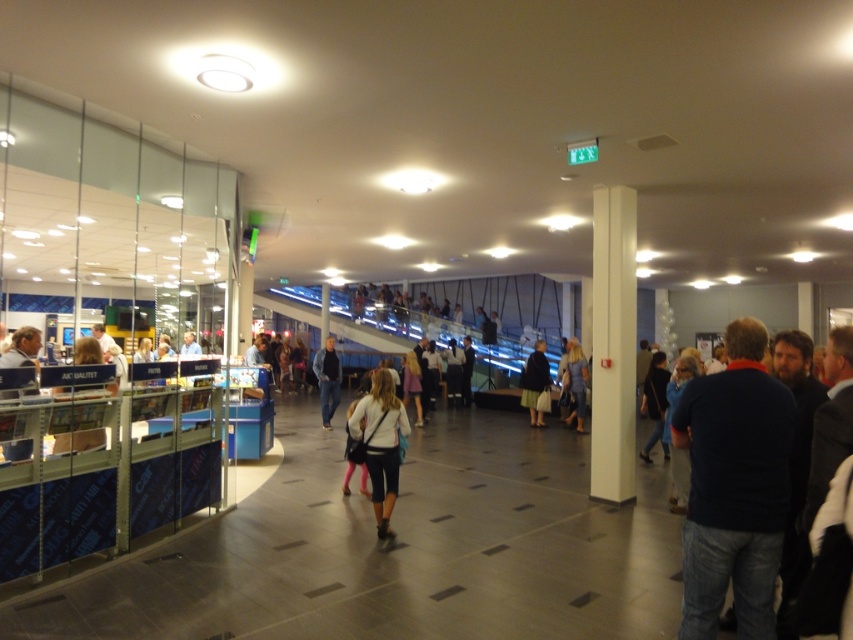
Is white matte shirt at center wider than light brown leather jacket at center?

Yes.

Between point (364, 458) and point (579, 358), which one is positioned behind?

The point (579, 358) is behind.

Is point (389, 448) farther from camera compared to point (570, 380)?

No, (389, 448) is in front of (570, 380).

Locate an element on the screen. The height and width of the screenshot is (640, 853). white matte shirt at center is located at coordinates (380, 444).

Does dark blue shirt at center-right appear on the right side of denim jeans at center?

Indeed, dark blue shirt at center-right is positioned on the right side of denim jeans at center.

The width and height of the screenshot is (853, 640). Describe the element at coordinates (734, 486) in the screenshot. I see `dark blue shirt at center-right` at that location.

Between point (762, 394) and point (332, 372), which one is positioned behind?

The point (332, 372) is more distant.

Locate an element on the screen. Image resolution: width=853 pixels, height=640 pixels. dark blue shirt at center-right is located at coordinates (734, 486).

Which is behind, point (741, 326) or point (572, 410)?

The point (572, 410) is behind.

Which is below, dark blue shirt at center-right or light brown leather jacket at center?

Positioned lower is light brown leather jacket at center.

Which is in front, point (766, 577) or point (579, 369)?

Point (766, 577)

The image size is (853, 640). Identify the location of dark blue shirt at center-right. (734, 486).